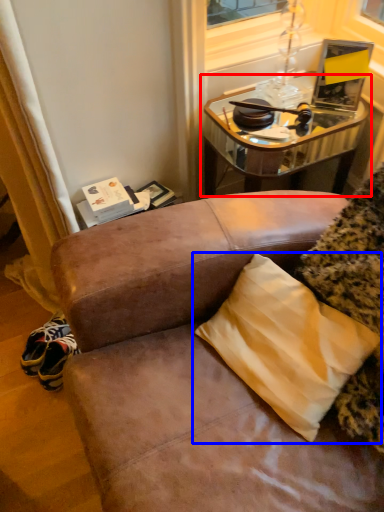
Question: Which of the following is the closest to the observer, table (highlighted by a red box) or pillow (highlighted by a blue box)?

Choices:
 (A) table
 (B) pillow

Answer: (B)